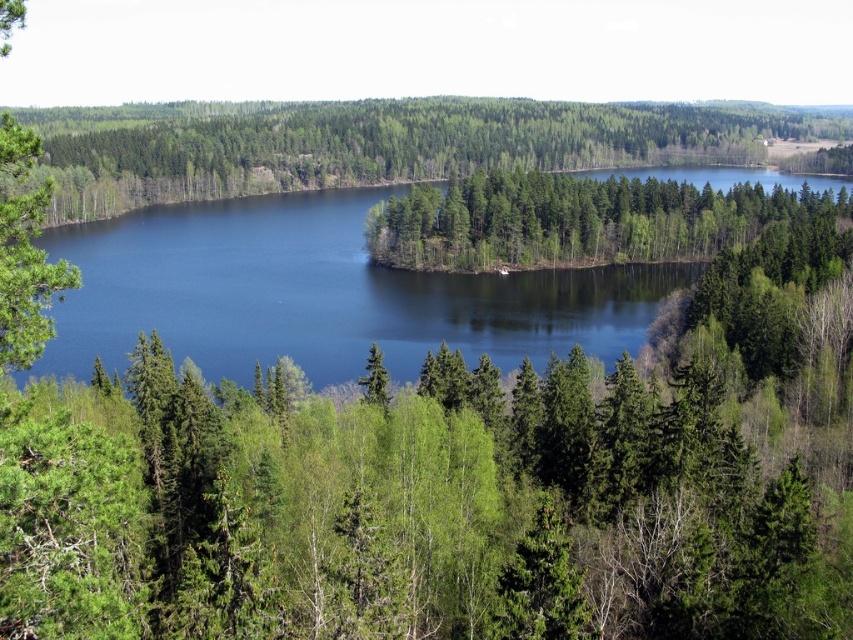
You are standing in the forest looking towards the lake. You see the green leafy trees at center and the green matte tree at left. Which tree is closer to you?

The green leafy trees at center are closer to you because the green matte tree at left is behind them.

You are standing at the edge of the lake and want to place a floating dock exactly at the center of the blue water at center. According to the coordinates provided, where should you position the dock?

The blue water at center is located at coordinates point (318, 294), so you should position the dock at those coordinates to place it exactly at the center of the blue water at center.